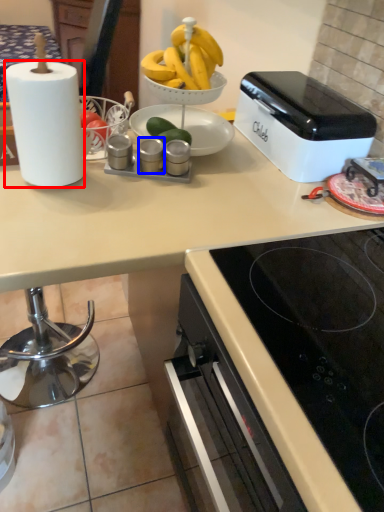
Question: Which object is closer to the camera taking this photo, paper towel (highlighted by a red box) or appliance (highlighted by a blue box)?

Choices:
 (A) paper towel
 (B) appliance

Answer: (A)